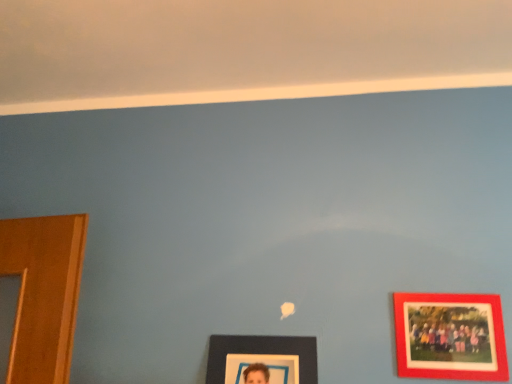
Question: From the image's perspective, is red matte picture frame at right, the first picture frame from the right, located above or below matte black picture frame at lower center, which is the 2th picture frame in right-to-left order?

Choices:
 (A) below
 (B) above

Answer: (B)

Question: From a real-world perspective, is red matte picture frame at right, the first picture frame from the right, positioned above or below matte black picture frame at lower center, the first picture frame viewed from the left?

Choices:
 (A) above
 (B) below

Answer: (A)

Question: Is red matte picture frame at right, the first picture frame from the right, wider or thinner than matte black picture frame at lower center, which is the 2th picture frame in right-to-left order?

Choices:
 (A) wide
 (B) thin

Answer: (B)

Question: From a real-world perspective, is matte black picture frame at lower center, the first picture frame viewed from the left, above or below red matte picture frame at right, the first picture frame from the right?

Choices:
 (A) below
 (B) above

Answer: (A)

Question: Is point (293, 339) closer or farther from the camera than point (424, 360)?

Choices:
 (A) closer
 (B) farther

Answer: (B)

Question: Is matte black picture frame at lower center, the first picture frame viewed from the left, wider or thinner than red matte picture frame at right, the first picture frame from the right?

Choices:
 (A) wide
 (B) thin

Answer: (A)

Question: Is matte black picture frame at lower center, the first picture frame viewed from the left, situated inside red matte picture frame at right, which is the second picture frame from left to right, or outside?

Choices:
 (A) outside
 (B) inside

Answer: (A)